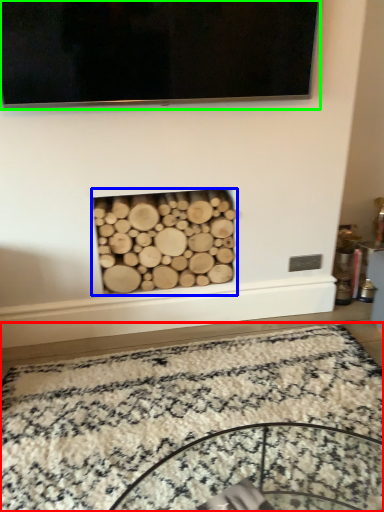
Question: Which is farther away from mat (highlighted by a red box)? fireplace (highlighted by a blue box) or television (highlighted by a green box)?

Choices:
 (A) fireplace
 (B) television

Answer: (B)